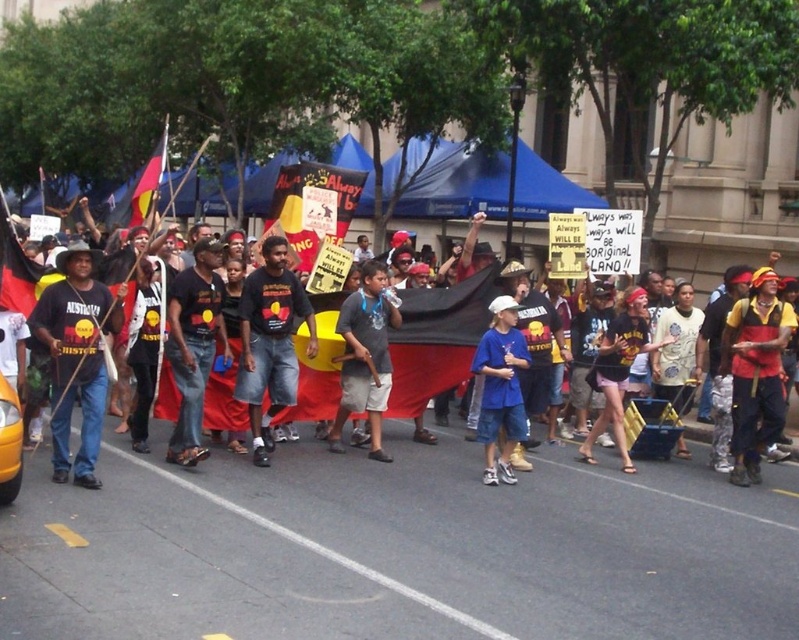
Question: Is matte black t-shirt at left closer to the viewer compared to dark blue jeans at center?

Choices:
 (A) no
 (B) yes

Answer: (B)

Question: Which point is farther to the camera?

Choices:
 (A) (85, 429)
 (B) (495, 266)

Answer: (B)

Question: Which of these objects is positioned farthest from the dark blue jeans at center?

Choices:
 (A) yellow fabric shirt at center
 (B) gray cotton t-shirt at center

Answer: (A)

Question: Which object appears closest to the camera in this image?

Choices:
 (A) matte black t-shirt at left
 (B) black t-shirt at center
 (C) dark blue jeans at center
 (D) dark blue t-shirt at center

Answer: (A)

Question: Does black t-shirt at center appear on the left side of yellow fabric shirt at center?

Choices:
 (A) yes
 (B) no

Answer: (A)

Question: Is black t-shirt at center above gray cotton t-shirt at center?

Choices:
 (A) yes
 (B) no

Answer: (A)